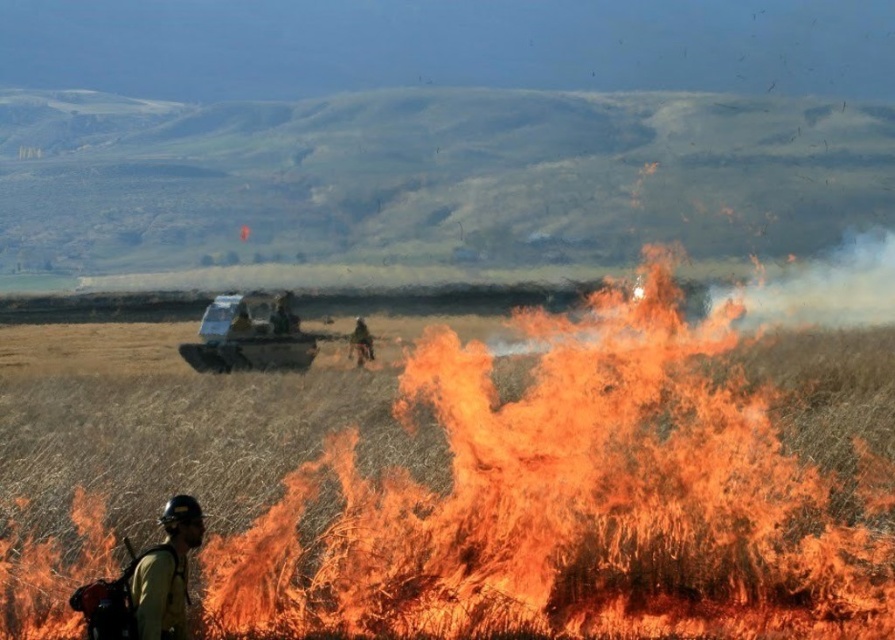
Can you confirm if grassy field at center is shorter than camouflage fabric jacket at center?

Incorrect, grassy field at center's height does not fall short of camouflage fabric jacket at center's.

Is grassy field at center thinner than camouflage fabric jacket at center?

No.

Who is more distant from viewer, [520,628] or [358,317]?

Point [358,317]

Where is `grassy field at center`? grassy field at center is located at coordinates (501, 493).

Who is higher up, grassy field at center or matte silver tank at center?

matte silver tank at center is above.

Does grassy field at center have a lesser width compared to matte silver tank at center?

In fact, grassy field at center might be wider than matte silver tank at center.

Is point (229, 497) closer to camera compared to point (229, 305)?

That is True.

Where is `grassy field at center`? Image resolution: width=895 pixels, height=640 pixels. grassy field at center is located at coordinates (501, 493).

Between matte silver tank at center and camouflage fabric jacket at center, which one is positioned higher?

matte silver tank at center is higher up.

Can you confirm if matte silver tank at center is thinner than camouflage fabric jacket at center?

No.

Image resolution: width=895 pixels, height=640 pixels. I want to click on matte silver tank at center, so click(249, 336).

Where is `matte silver tank at center`? matte silver tank at center is located at coordinates (249, 336).